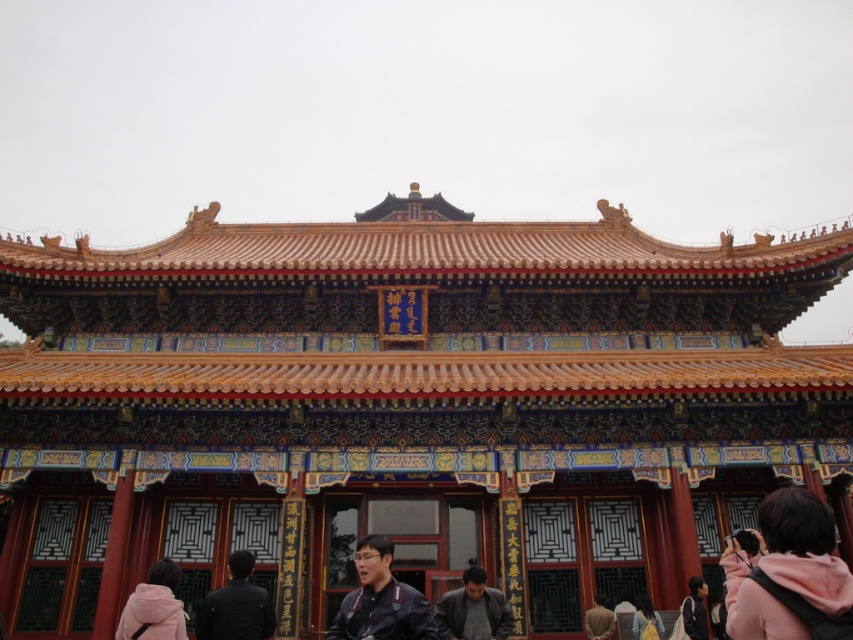
Is golden ornate roof at center taller than dark gray jacket at lower center?

Yes, golden ornate roof at center is taller than dark gray jacket at lower center.

Can you confirm if golden ornate roof at center is shorter than dark gray jacket at lower center?

No, golden ornate roof at center is not shorter than dark gray jacket at lower center.

Does point (508, 234) lie in front of point (502, 608)?

No, (508, 234) is further to viewer.

In order to click on golden ornate roof at center in this screenshot , I will do `click(405, 406)`.

Who is lower down, yellow fabric bag at lower right or brown fabric bag at lower center?

brown fabric bag at lower center is lower down.

In the scene shown: Between yellow fabric bag at lower right and brown fabric bag at lower center, which one appears on the left side from the viewer's perspective?

brown fabric bag at lower center

Between point (645, 595) and point (602, 632), which one is positioned behind?

The point (645, 595) is behind.

You are a GUI agent. You are given a task and a screenshot of the screen. Output one action in this format:
    pyautogui.click(x=<x>, y=<y>)
    Task: Click on the yellow fabric bag at lower right
    This screenshot has width=853, height=640.
    Given the screenshot: What is the action you would take?
    pyautogui.click(x=646, y=620)

Does pink fleece jacket at lower right have a lesser height compared to black fabric jacket at lower center?

Correct, pink fleece jacket at lower right is not as tall as black fabric jacket at lower center.

Locate an element on the screen. pink fleece jacket at lower right is located at coordinates (788, 573).